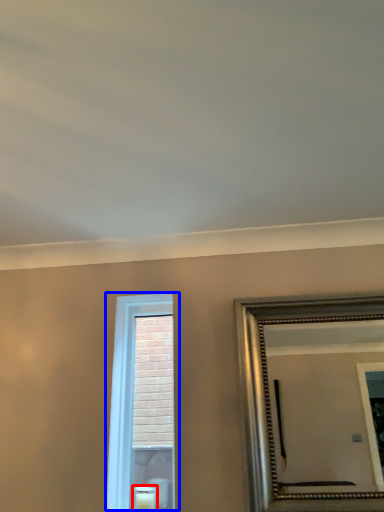
Question: Which point is closer to the camera, candle (highlighted by a red box) or window (highlighted by a blue box)?

Choices:
 (A) candle
 (B) window

Answer: (A)